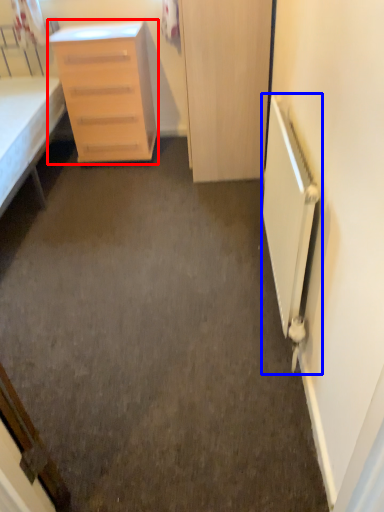
Question: Among these objects, which one is farthest to the camera, chest of drawers (highlighted by a red box) or radiator (highlighted by a blue box)?

Choices:
 (A) chest of drawers
 (B) radiator

Answer: (A)